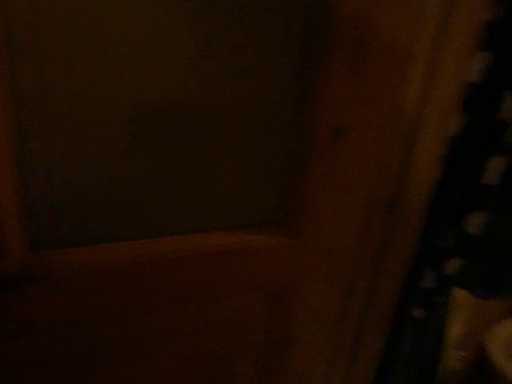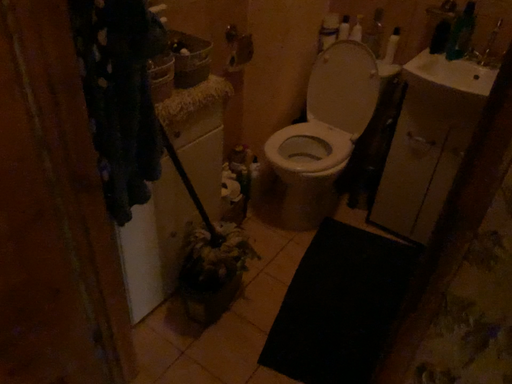
Question: How did the camera likely rotate when shooting the video?

Choices:
 (A) rotated upward
 (B) rotated downward

Answer: (B)